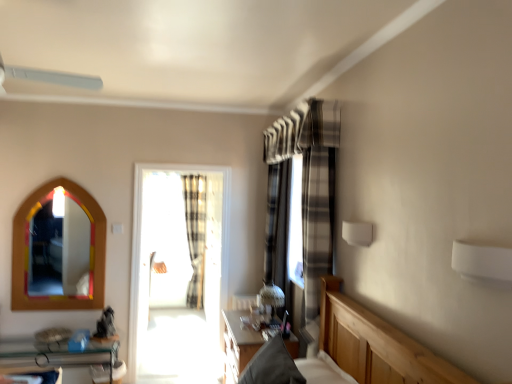
Question: Is multicolored wooden mirror at left facing towards wooden table at center?

Choices:
 (A) yes
 (B) no

Answer: (B)

Question: Is multicolored wooden mirror at left located outside wooden table at center?

Choices:
 (A) yes
 (B) no

Answer: (A)

Question: Does multicolored wooden mirror at left have a lesser height compared to wooden table at center?

Choices:
 (A) yes
 (B) no

Answer: (B)

Question: Is multicolored wooden mirror at left placed right next to wooden table at center?

Choices:
 (A) no
 (B) yes

Answer: (A)

Question: Is multicolored wooden mirror at left thinner than wooden table at center?

Choices:
 (A) no
 (B) yes

Answer: (B)

Question: Considering the relative sizes of multicolored wooden mirror at left and wooden table at center in the image provided, is multicolored wooden mirror at left wider than wooden table at center?

Choices:
 (A) yes
 (B) no

Answer: (B)

Question: Can clear glass shelf at lower left be found inside plaid fabric curtain at center, the 2th curtain viewed from the front?

Choices:
 (A) no
 (B) yes

Answer: (A)

Question: From a real-world perspective, is plaid fabric curtain at center, arranged as the first curtain when viewed from the left, positioned over clear glass shelf at lower left based on gravity?

Choices:
 (A) no
 (B) yes

Answer: (B)

Question: Can you confirm if plaid fabric curtain at center, the 1th curtain viewed from the back, is thinner than clear glass shelf at lower left?

Choices:
 (A) no
 (B) yes

Answer: (B)

Question: Is plaid fabric curtain at center, arranged as the first curtain when viewed from the left, shorter than clear glass shelf at lower left?

Choices:
 (A) yes
 (B) no

Answer: (B)

Question: Considering the relative sizes of plaid fabric curtain at center, the 2th curtain viewed from the front, and clear glass shelf at lower left in the image provided, is plaid fabric curtain at center, the 2th curtain viewed from the front, smaller than clear glass shelf at lower left?

Choices:
 (A) yes
 (B) no

Answer: (A)

Question: Can you confirm if plaid fabric curtain at center, the 1th curtain viewed from the back, is bigger than clear glass shelf at lower left?

Choices:
 (A) yes
 (B) no

Answer: (B)

Question: Is multicolored wooden mirror at left further to the viewer compared to plaid fabric curtain at center, the 2th curtain viewed from the front?

Choices:
 (A) no
 (B) yes

Answer: (A)